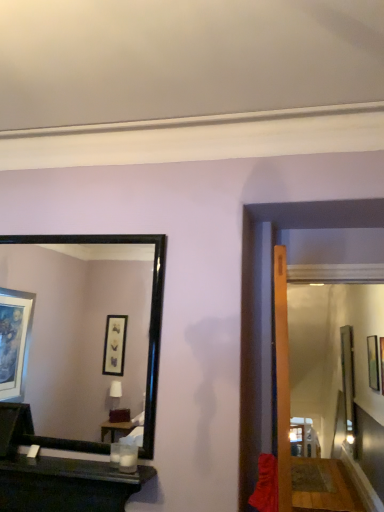
Question: In terms of height, does metallic silver picture frame at upper right look taller or shorter compared to black glossy mirror at upper left?

Choices:
 (A) tall
 (B) short

Answer: (B)

Question: In the image, is metallic silver picture frame at upper right on the left side or the right side of black glossy mirror at upper left?

Choices:
 (A) left
 (B) right

Answer: (B)

Question: Relative to black glossy mirror at upper left, is metallic silver picture frame at upper right in front or behind?

Choices:
 (A) behind
 (B) front

Answer: (A)

Question: Is black glossy mirror at upper left wider or thinner than metallic silver picture frame at upper right?

Choices:
 (A) wide
 (B) thin

Answer: (A)

Question: Would you say black glossy mirror at upper left is to the left or to the right of metallic silver picture frame at upper right in the picture?

Choices:
 (A) right
 (B) left

Answer: (B)

Question: From their relative heights in the image, would you say black glossy mirror at upper left is taller or shorter than metallic silver picture frame at upper right?

Choices:
 (A) short
 (B) tall

Answer: (B)

Question: From a real-world perspective, relative to metallic silver picture frame at upper right, is black glossy mirror at upper left vertically above or below?

Choices:
 (A) above
 (B) below

Answer: (A)